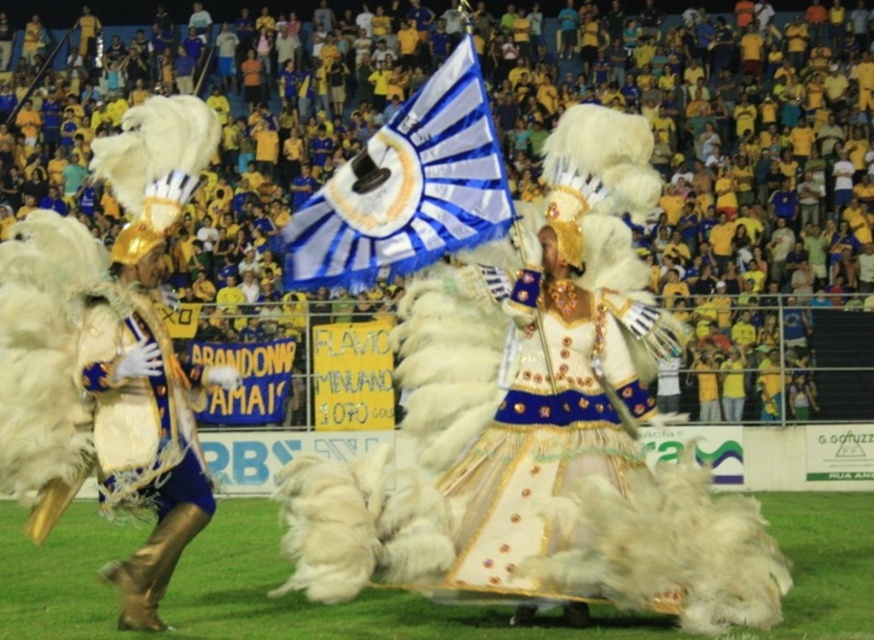
Question: Is yellow fabric crowd at upper center positioned before blue and white fabric flag at center?

Choices:
 (A) no
 (B) yes

Answer: (A)

Question: Which object appears farthest from the camera in this image?

Choices:
 (A) blue and white fabric flag at center
 (B) yellow fabric crowd at upper center

Answer: (B)

Question: Among these objects, which one is nearest to the camera?

Choices:
 (A) blue and white fabric flag at center
 (B) yellow fabric crowd at upper center

Answer: (A)

Question: Can you confirm if yellow fabric crowd at upper center is smaller than blue and white fabric flag at center?

Choices:
 (A) yes
 (B) no

Answer: (B)

Question: Observing the image, what is the correct spatial positioning of yellow fabric crowd at upper center in reference to blue and white fabric flag at center?

Choices:
 (A) above
 (B) below

Answer: (A)